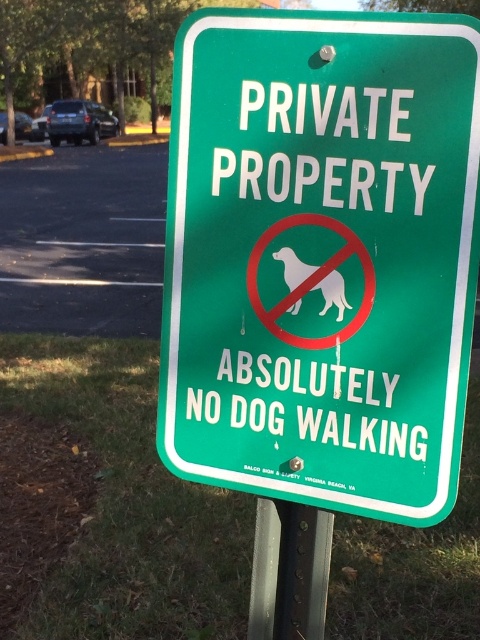
Question: Which of the following is the farthest from the observer?

Choices:
 (A) green metallic pole at lower center
 (B) white paper dog at center
 (C) green plastic sign at center

Answer: (A)

Question: Which is farther from the green metallic pole at lower center?

Choices:
 (A) green plastic sign at center
 (B) white paper dog at center

Answer: (B)

Question: Does green plastic sign at center lie behind green metallic pole at lower center?

Choices:
 (A) yes
 (B) no

Answer: (B)

Question: Is green plastic sign at center closer to the viewer compared to green metallic pole at lower center?

Choices:
 (A) no
 (B) yes

Answer: (B)

Question: Where is green plastic sign at center located in relation to green metallic pole at lower center in the image?

Choices:
 (A) below
 (B) above

Answer: (B)

Question: Which is farther from the green plastic sign at center?

Choices:
 (A) white paper dog at center
 (B) green metallic pole at lower center

Answer: (B)